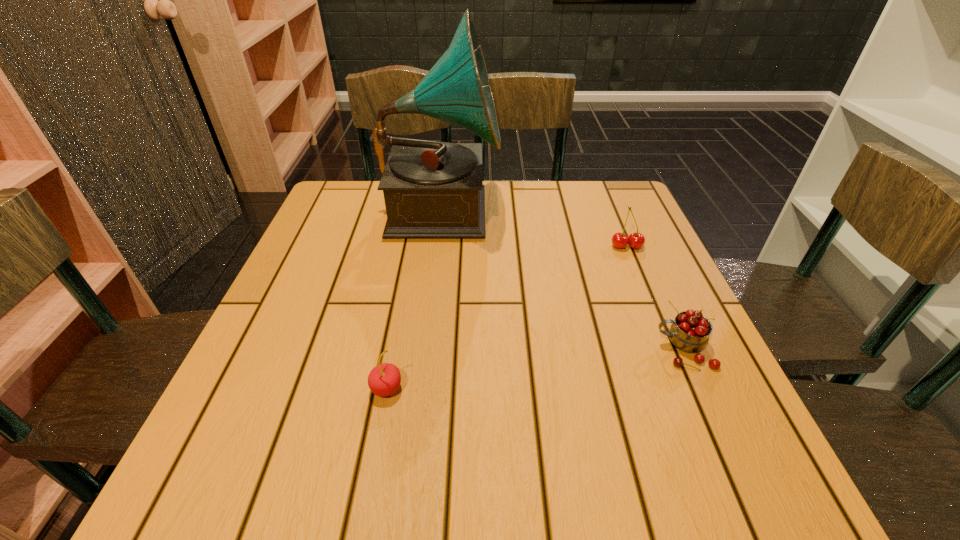
What are the coordinates of `vacant space located on the handle side of the second nearest object` in the screenshot? It's located at (587, 349).

This screenshot has height=540, width=960. What are the coordinates of `vacant space situated on the handle side of the second nearest object` in the screenshot? It's located at (478, 349).

Image resolution: width=960 pixels, height=540 pixels. In order to click on object at the far edge in this screenshot , I will do `click(431, 189)`.

I want to click on free region at the far edge of the desktop, so click(580, 223).

The width and height of the screenshot is (960, 540). Find the location of `vacant area at the near edge`. vacant area at the near edge is located at coordinates (519, 453).

Where is `free space at the left edge`? The image size is (960, 540). free space at the left edge is located at coordinates (299, 278).

The image size is (960, 540). In order to click on free space at the right edge in this screenshot , I will do `click(671, 368)`.

This screenshot has width=960, height=540. I want to click on vacant space at the far left corner of the desktop, so [320, 208].

What are the coordinates of `free space at the far right corner of the desktop` in the screenshot? It's located at (580, 213).

Find the location of a particular element. Image resolution: width=960 pixels, height=540 pixels. free space at the near right corner is located at coordinates (724, 473).